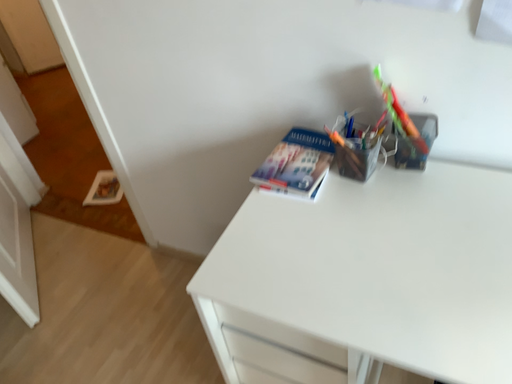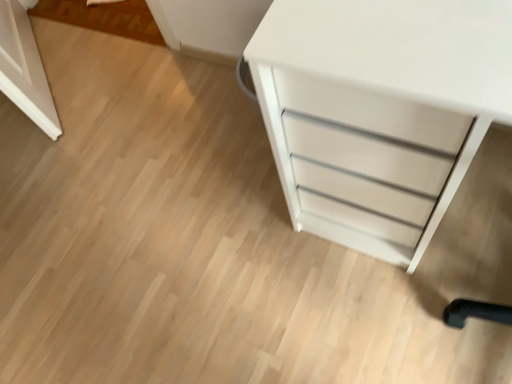
Question: Which way did the camera rotate in the video?

Choices:
 (A) rotated downward
 (B) rotated upward

Answer: (A)